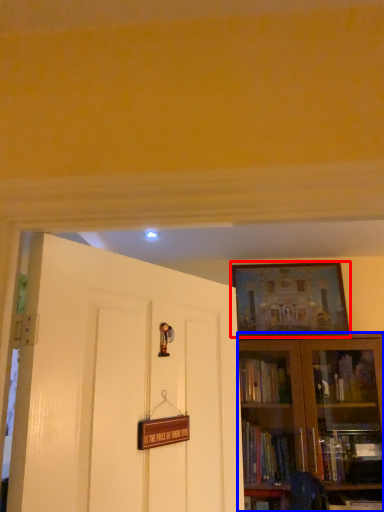
Question: Which object appears closest to the camera in this image, picture frame (highlighted by a red box) or bookcase (highlighted by a blue box)?

Choices:
 (A) picture frame
 (B) bookcase

Answer: (B)